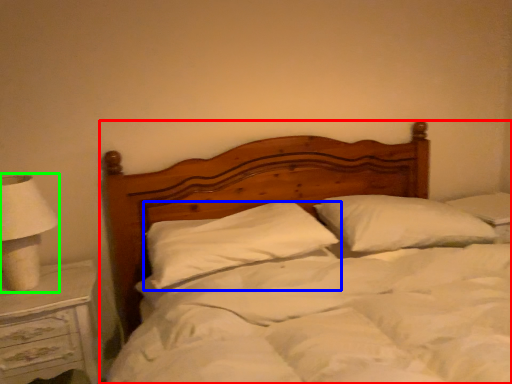
Question: Estimate the real-world distances between objects in this image. Which object is farther from bed (highlighted by a red box), pillow (highlighted by a blue box) or lamp (highlighted by a green box)?

Choices:
 (A) pillow
 (B) lamp

Answer: (B)